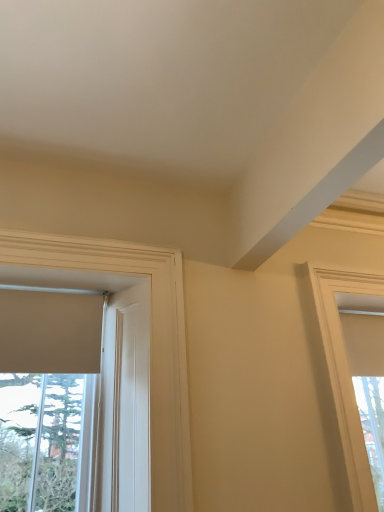
Describe the element at coordinates (345, 372) in the screenshot. Image resolution: width=384 pixels, height=512 pixels. I see `matte white window at right, which ranks as the 2th window in left-to-right order` at that location.

Image resolution: width=384 pixels, height=512 pixels. What are the coordinates of `matte white window at right, the first window when ordered from right to left` in the screenshot? It's located at (345, 372).

What do you see at coordinates (150, 342) in the screenshot? I see `white matte window at left, the 2th window in the right-to-left sequence` at bounding box center [150, 342].

Locate an element on the screen. The height and width of the screenshot is (512, 384). white matte window at left, the 2th window in the right-to-left sequence is located at coordinates (150, 342).

In order to face white matte window at left, which ranks as the 1th window in left-to-right order, should I rotate leftwards or rightwards?

Turn left approximately 13.357 degrees to face it.

What is the approximate height of white matte window at left, which ranks as the 1th window in left-to-right order?

It is 1.05 meters.

Where is `matte white window at right, the first window when ordered from right to left`? matte white window at right, the first window when ordered from right to left is located at coordinates (345, 372).

Does matte white window at right, the first window when ordered from right to left, appear on the right side of white matte window at left, the 2th window in the right-to-left sequence?

Correct, you'll find matte white window at right, the first window when ordered from right to left, to the right of white matte window at left, the 2th window in the right-to-left sequence.

From the picture: Which object is more forward, matte white window at right, which ranks as the 2th window in left-to-right order, or white matte window at left, which ranks as the 1th window in left-to-right order?

white matte window at left, which ranks as the 1th window in left-to-right order, is closer to the camera.

Is point (316, 269) closer to viewer compared to point (73, 248)?

No.

From the image's perspective, is matte white window at right, the first window when ordered from right to left, on white matte window at left, the 2th window in the right-to-left sequence?

No.

From a real-world perspective, is matte white window at right, the first window when ordered from right to left, below white matte window at left, the 2th window in the right-to-left sequence?

Correct, in the physical world, matte white window at right, the first window when ordered from right to left, is lower than white matte window at left, the 2th window in the right-to-left sequence.

Looking at their sizes, would you say matte white window at right, which ranks as the 2th window in left-to-right order, is wider or thinner than white matte window at left, the 2th window in the right-to-left sequence?

matte white window at right, which ranks as the 2th window in left-to-right order, is thinner than white matte window at left, the 2th window in the right-to-left sequence.

From their relative heights in the image, would you say matte white window at right, the first window when ordered from right to left, is taller or shorter than white matte window at left, which ranks as the 1th window in left-to-right order?

Clearly, matte white window at right, the first window when ordered from right to left, is taller compared to white matte window at left, which ranks as the 1th window in left-to-right order.

Who is smaller, matte white window at right, which ranks as the 2th window in left-to-right order, or white matte window at left, which ranks as the 1th window in left-to-right order?

matte white window at right, which ranks as the 2th window in left-to-right order.

Is matte white window at right, the first window when ordered from right to left, not within white matte window at left, the 2th window in the right-to-left sequence?

Yes, matte white window at right, the first window when ordered from right to left, is not within white matte window at left, the 2th window in the right-to-left sequence.

Is matte white window at right, which ranks as the 2th window in left-to-right order, touching white matte window at left, which ranks as the 1th window in left-to-right order?

No, matte white window at right, which ranks as the 2th window in left-to-right order, is not next to white matte window at left, which ranks as the 1th window in left-to-right order.

Is matte white window at right, which ranks as the 2th window in left-to-right order, aimed at white matte window at left, which ranks as the 1th window in left-to-right order?

No, matte white window at right, which ranks as the 2th window in left-to-right order, is not aimed at white matte window at left, which ranks as the 1th window in left-to-right order.

Locate an element on the screen. The width and height of the screenshot is (384, 512). window above the matte white window at right, the first window when ordered from right to left (from the image's perspective) is located at coordinates (150, 342).

Does white matte window at left, which ranks as the 1th window in left-to-right order, appear on the left side of matte white window at right, which ranks as the 2th window in left-to-right order?

Indeed, white matte window at left, which ranks as the 1th window in left-to-right order, is positioned on the left side of matte white window at right, which ranks as the 2th window in left-to-right order.

From the picture: Considering the positions of objects white matte window at left, the 2th window in the right-to-left sequence, and matte white window at right, the first window when ordered from right to left, in the image provided, who is behind, white matte window at left, the 2th window in the right-to-left sequence, or matte white window at right, the first window when ordered from right to left,?

matte white window at right, the first window when ordered from right to left, is more distant.

Between point (93, 267) and point (331, 298), which one is positioned behind?

Positioned behind is point (331, 298).

From the image's perspective, is white matte window at left, which ranks as the 1th window in left-to-right order, beneath matte white window at right, which ranks as the 2th window in left-to-right order?

Incorrect, from the image's perspective, white matte window at left, which ranks as the 1th window in left-to-right order, is higher than matte white window at right, which ranks as the 2th window in left-to-right order.

From a real-world perspective, relative to matte white window at right, which ranks as the 2th window in left-to-right order, is white matte window at left, which ranks as the 1th window in left-to-right order, vertically above or below?

Clearly, from a real-world perspective, white matte window at left, which ranks as the 1th window in left-to-right order, is above matte white window at right, which ranks as the 2th window in left-to-right order.

From the picture: Does white matte window at left, which ranks as the 1th window in left-to-right order, have a greater width compared to matte white window at right, which ranks as the 2th window in left-to-right order?

Correct, the width of white matte window at left, which ranks as the 1th window in left-to-right order, exceeds that of matte white window at right, which ranks as the 2th window in left-to-right order.

Which of these two, white matte window at left, the 2th window in the right-to-left sequence, or matte white window at right, the first window when ordered from right to left, stands shorter?

white matte window at left, the 2th window in the right-to-left sequence.

Does white matte window at left, the 2th window in the right-to-left sequence, have a smaller size compared to matte white window at right, the first window when ordered from right to left?

No, white matte window at left, the 2th window in the right-to-left sequence, is not smaller than matte white window at right, the first window when ordered from right to left.

Is white matte window at left, the 2th window in the right-to-left sequence, surrounding matte white window at right, which ranks as the 2th window in left-to-right order?

No, matte white window at right, which ranks as the 2th window in left-to-right order, is not a part of white matte window at left, the 2th window in the right-to-left sequence.

Would you say white matte window at left, the 2th window in the right-to-left sequence, is a long distance from matte white window at right, which ranks as the 2th window in left-to-right order?

Actually, white matte window at left, the 2th window in the right-to-left sequence, and matte white window at right, which ranks as the 2th window in left-to-right order, are a little close together.

Could you tell me if white matte window at left, the 2th window in the right-to-left sequence, is facing matte white window at right, which ranks as the 2th window in left-to-right order?

No, white matte window at left, the 2th window in the right-to-left sequence, is not aimed at matte white window at right, which ranks as the 2th window in left-to-right order.

How many degrees apart are the facing directions of white matte window at left, the 2th window in the right-to-left sequence, and matte white window at right, which ranks as the 2th window in left-to-right order?

There is a 1.56-degree angle between the facing directions of white matte window at left, the 2th window in the right-to-left sequence, and matte white window at right, which ranks as the 2th window in left-to-right order.

Identify the location of window in front of the matte white window at right, which ranks as the 2th window in left-to-right order. (150, 342).

What are the coordinates of `window on the left of matte white window at right, which ranks as the 2th window in left-to-right order` in the screenshot? It's located at (150, 342).

The height and width of the screenshot is (512, 384). Find the location of `window below the white matte window at left, the 2th window in the right-to-left sequence (from the image's perspective)`. window below the white matte window at left, the 2th window in the right-to-left sequence (from the image's perspective) is located at coordinates (345, 372).